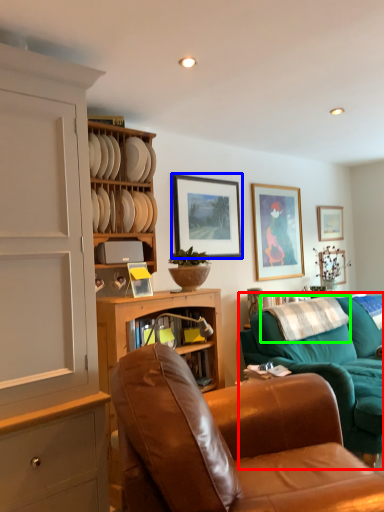
Question: Which object is positioned closest to studio couch (highlighted by a red box)? Select from picture frame (highlighted by a blue box) and pillow (highlighted by a green box).

Choices:
 (A) picture frame
 (B) pillow

Answer: (B)